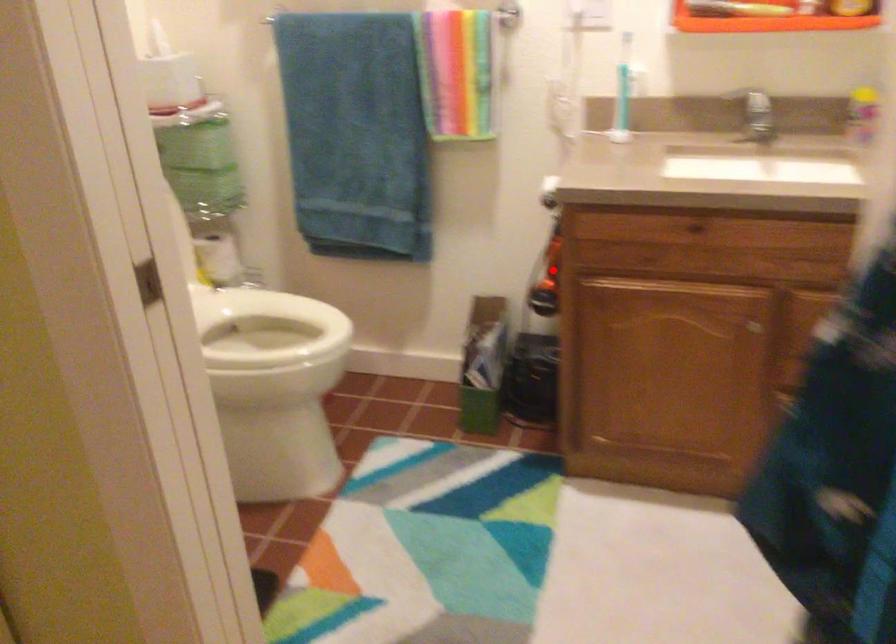
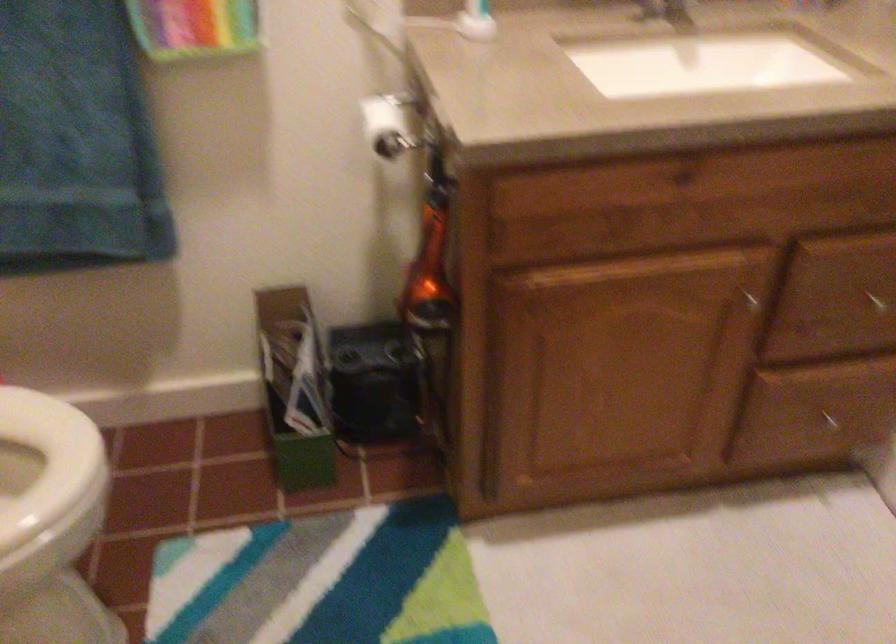
Question: A red point is marked in image1. In image2, is the corresponding 3D point closer to the camera or farther? Reply with the corresponding letter.

Choices:
 (A) The corresponding 3D point is closer.
 (B) The corresponding 3D point is farther.

Answer: (A)